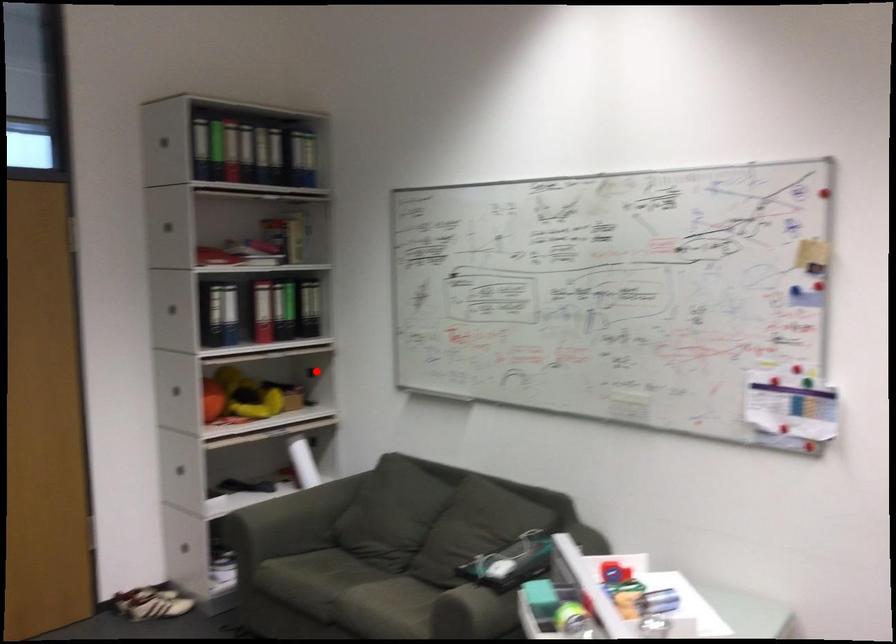
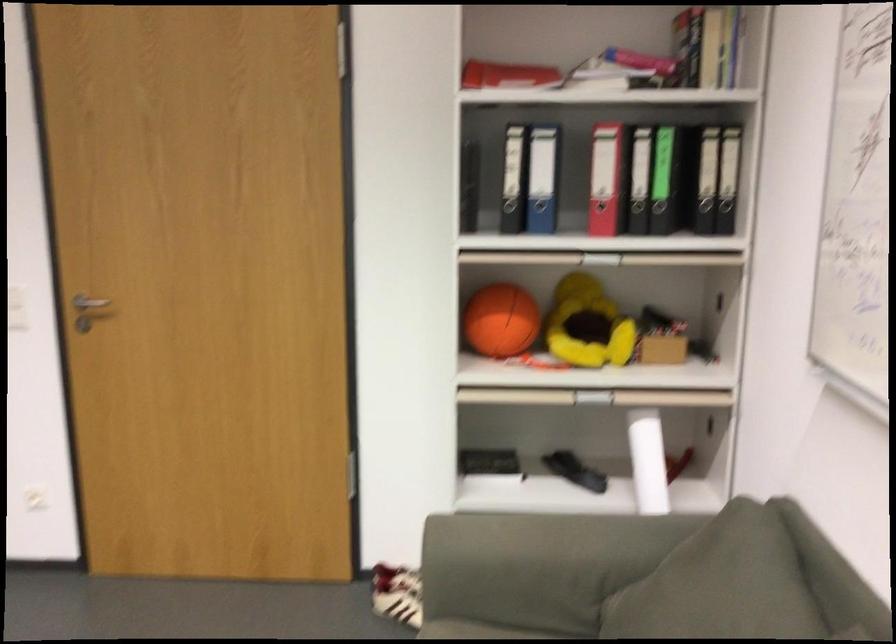
Question: I am providing you with two images of the same scene from different viewpoints. Given a red point in image1, look at the same physical point in image2. Is it:

Choices:
 (A) Closer to the viewpoint
 (B) Farther from the viewpoint

Answer: (A)